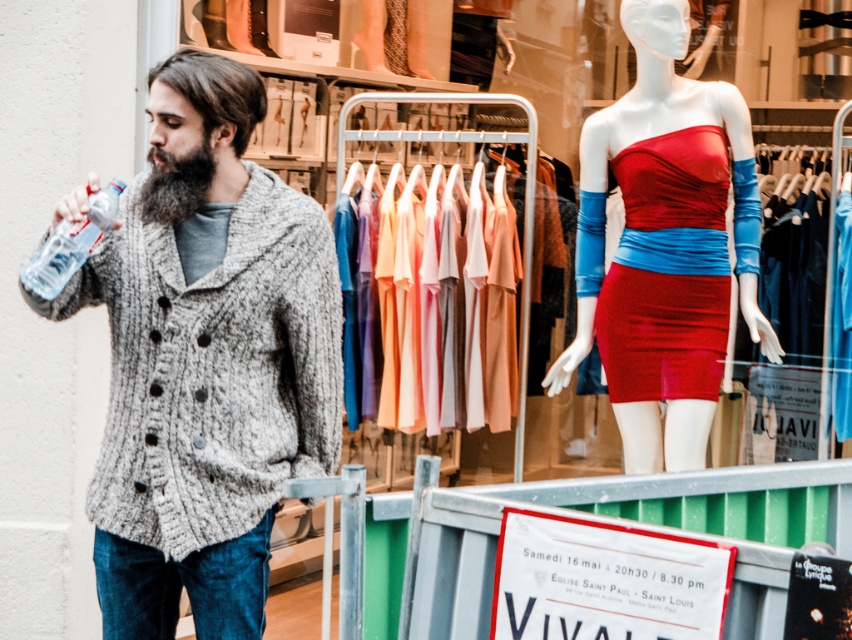
You are a customer in the store and want to take both the shiny red dress at center and the satin red dress at center to the fitting room. The fitting room is located behind the metal rack holding several garments. Can you carry both dresses at the same time while walking around the metal rack?

The shiny red dress at center and the satin red dress at center are 5.40 centimeters apart, so they are close enough to each other that you can easily carry both dresses at the same time while navigating around the metal rack.

You are standing at the entrance of the clothing store and want to locate the shiny red dress at center. According to the store layout, where should you look relative to the metal rack holding dresses?

The shiny red dress at center is positioned behind the metal rack holding dresses, so you should look behind the metal rack holding dresses to find it.